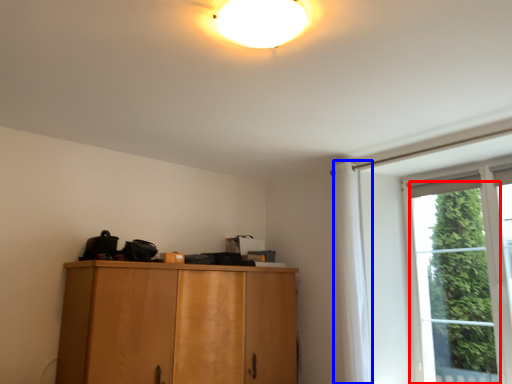
Question: Which point is closer to the camera, window (highlighted by a red box) or curtain (highlighted by a blue box)?

Choices:
 (A) window
 (B) curtain

Answer: (A)